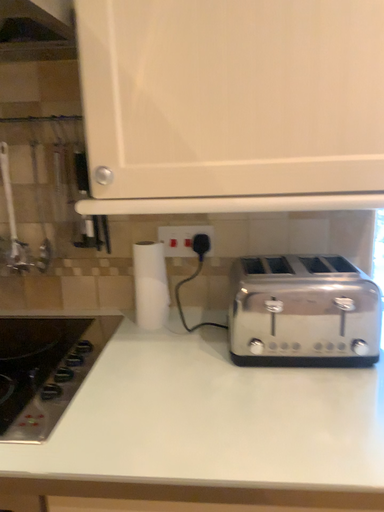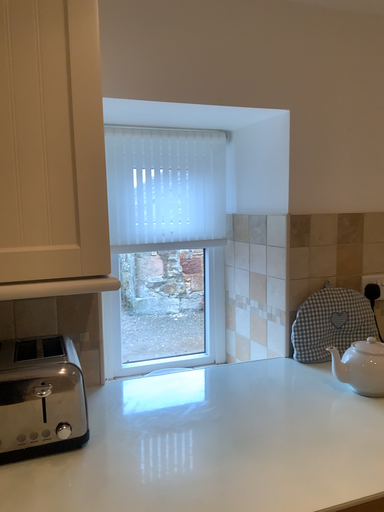
Question: Which way did the camera rotate in the video?

Choices:
 (A) rotated upward
 (B) rotated downward

Answer: (A)